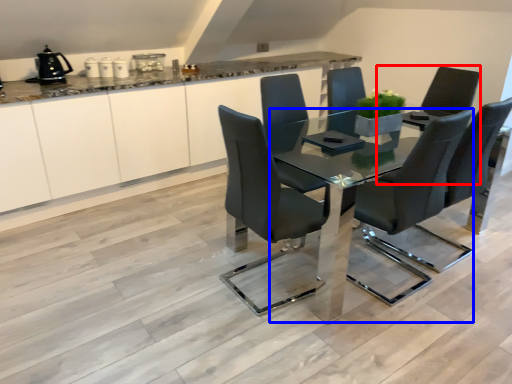
Question: Which object appears closest to the camera in this image, armchair (highlighted by a red box) or table (highlighted by a blue box)?

Choices:
 (A) armchair
 (B) table

Answer: (B)